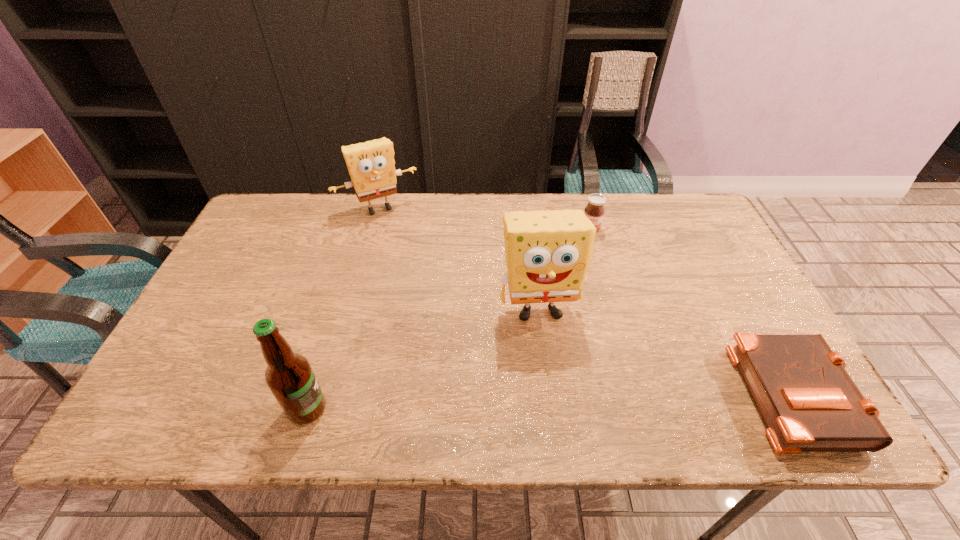
Identify the location of vacant region that satisfies the following two spatial constraints: 1. on the front side of the Bible; 2. on the spine side of the second object from right to left. (636, 393).

You are a GUI agent. You are given a task and a screenshot of the screen. Output one action in this format:
    pyautogui.click(x=<x>, y=<y>)
    Task: Click on the vacant point that satisfies the following two spatial constraints: 1. on the front side of the shorter sponge; 2. on the spine side of the shortest object
    The width and height of the screenshot is (960, 540).
    Given the screenshot: What is the action you would take?
    tap(329, 393)

Find the location of a particular element. This screenshot has width=960, height=540. free space that satisfies the following two spatial constraints: 1. on the front side of the rightmost object; 2. on the spine side of the nearer sponge is located at coordinates (550, 393).

Where is `free location that satisfies the following two spatial constraints: 1. on the back side of the fourth object from left to right; 2. on the left side of the nearer sponge`? Image resolution: width=960 pixels, height=540 pixels. free location that satisfies the following two spatial constraints: 1. on the back side of the fourth object from left to right; 2. on the left side of the nearer sponge is located at coordinates (529, 228).

This screenshot has width=960, height=540. What are the coordinates of `vacant point that satisfies the following two spatial constraints: 1. on the front side of the second farthest object; 2. on the spine side of the rightmost object` in the screenshot? It's located at point(636,393).